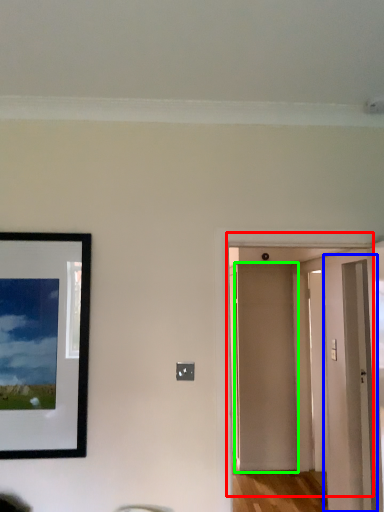
Question: Based on their relative distances, which object is farther from door (highlighted by a red box)? Choose from glass door (highlighted by a blue box) and door (highlighted by a green box).

Choices:
 (A) glass door
 (B) door

Answer: (A)